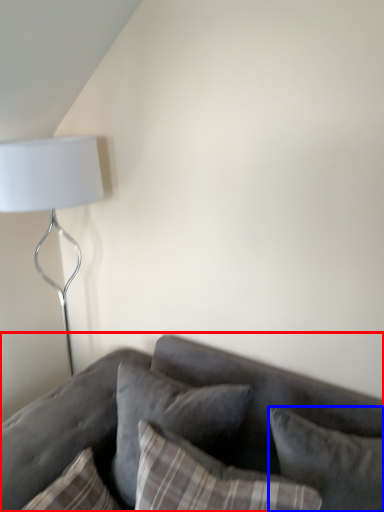
Question: Which object appears closest to the camera in this image, studio couch (highlighted by a red box) or pillow (highlighted by a blue box)?

Choices:
 (A) studio couch
 (B) pillow

Answer: (A)